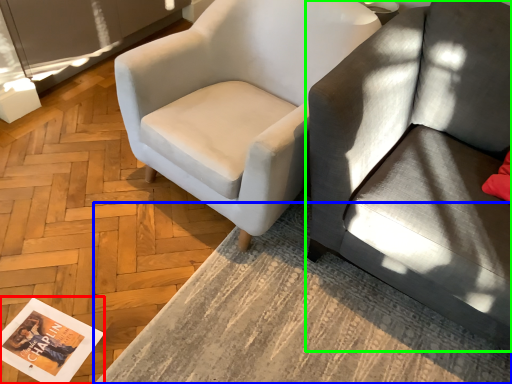
Question: Estimate the real-world distances between objects in this image. Which object is closer to magazine (highlighted by a red box), table (highlighted by a blue box) or studio couch (highlighted by a green box)?

Choices:
 (A) table
 (B) studio couch

Answer: (A)